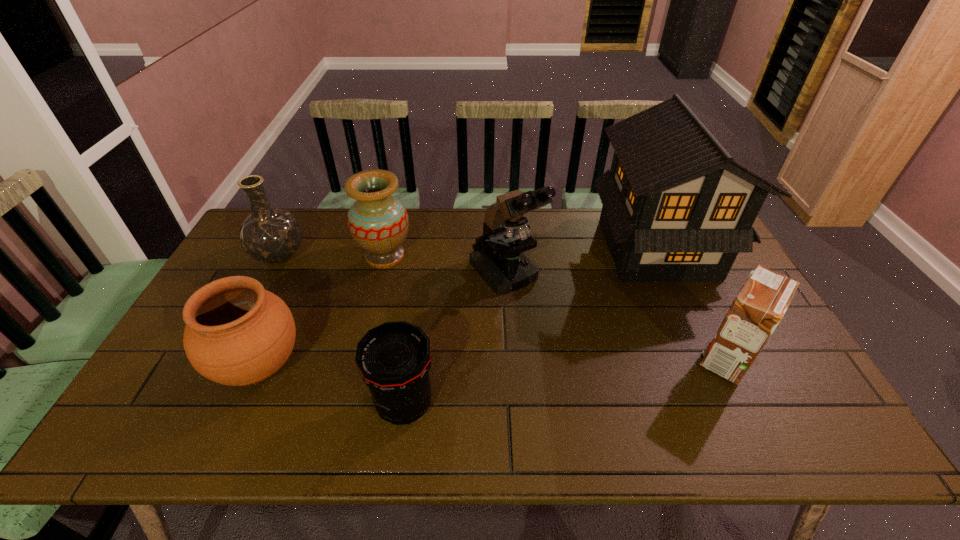
Identify the location of vacant space located on the front-facing side of the dollhouse. (550, 248).

This screenshot has width=960, height=540. Find the location of `vacant space situated 0.070m on the front of the fifth object from left to right`. vacant space situated 0.070m on the front of the fifth object from left to right is located at coordinates (508, 322).

The image size is (960, 540). In order to click on vacant region located on the front of the left vase in this screenshot , I will do `click(218, 379)`.

This screenshot has width=960, height=540. I want to click on vacant region located 0.320m on the front of the right vase, so tap(360, 359).

The width and height of the screenshot is (960, 540). I want to click on free location located on the straw side of the carton, so click(x=648, y=359).

Image resolution: width=960 pixels, height=540 pixels. Find the location of `free space located on the straw side of the carton`. free space located on the straw side of the carton is located at coordinates (587, 359).

Locate an element on the screen. The image size is (960, 540). free location located on the straw side of the carton is located at coordinates (610, 359).

Image resolution: width=960 pixels, height=540 pixels. I want to click on free spot located on the right of the pottery, so click(x=427, y=366).

Where is `blank space located on the left of the telephoto lens`? This screenshot has width=960, height=540. blank space located on the left of the telephoto lens is located at coordinates (233, 404).

What are the coordinates of `dollhouse located at the far edge` in the screenshot? It's located at (682, 194).